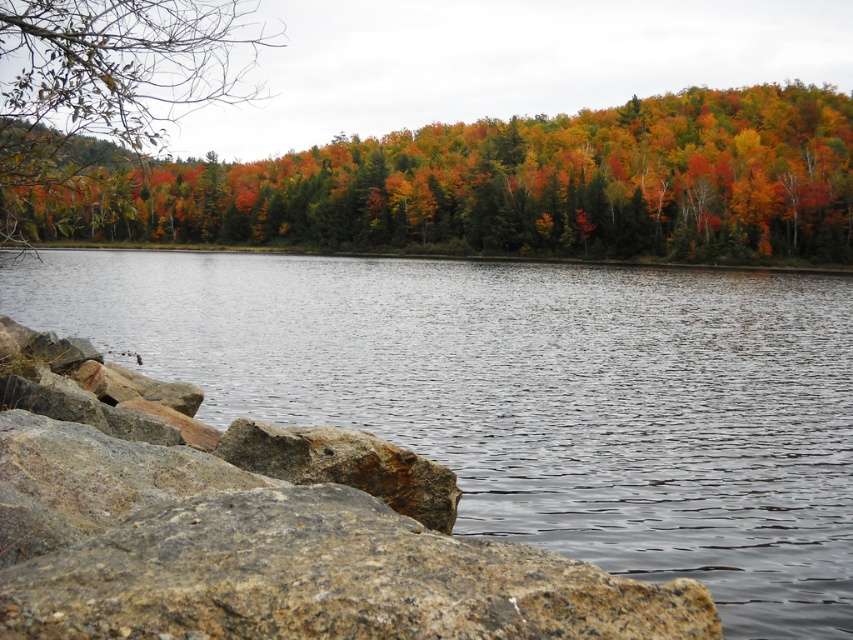
Question: Is clear water at center positioned at the back of autumn foliage at upper center?

Choices:
 (A) no
 (B) yes

Answer: (B)

Question: Among these objects, which one is farthest from the camera?

Choices:
 (A) clear water at center
 (B) autumn foliage at upper center
 (C) green matte tree at upper left

Answer: (A)

Question: Which point is farther to the camera?

Choices:
 (A) clear water at center
 (B) green matte tree at upper left

Answer: (A)

Question: Considering the real-world distances, which object is closest to the autumn foliage at upper center?

Choices:
 (A) clear water at center
 (B) green matte tree at upper left
 (C) gray granite boulder at lower left

Answer: (B)

Question: From the image, what is the correct spatial relationship of clear water at center in relation to autumn foliage at upper center?

Choices:
 (A) above
 (B) below

Answer: (B)

Question: Is clear water at center to the right of gray granite boulder at lower left from the viewer's perspective?

Choices:
 (A) no
 (B) yes

Answer: (B)